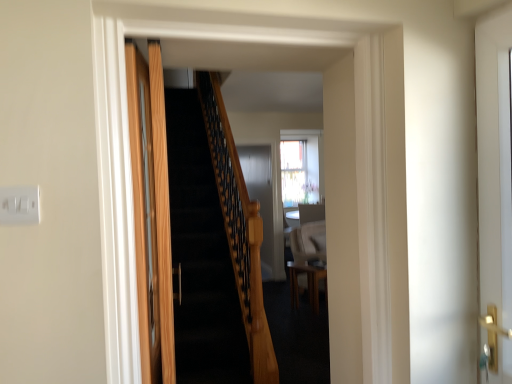
Question: Considering the relative sizes of wooden door at left, the 2th door positioned from the right, and white glossy door at right, the first door viewed from the right, in the image provided, is wooden door at left, the 2th door positioned from the right, wider than white glossy door at right, the first door viewed from the right,?

Choices:
 (A) yes
 (B) no

Answer: (A)

Question: Can you confirm if wooden door at left, the 2th door positioned from the right, is smaller than white glossy door at right, the first door viewed from the right?

Choices:
 (A) yes
 (B) no

Answer: (B)

Question: Does wooden door at left, which is the 1th door from left to right, appear on the left side of white glossy door at right, arranged as the 2th door when viewed from the left?

Choices:
 (A) yes
 (B) no

Answer: (A)

Question: From the image's perspective, does wooden door at left, which is the 1th door from left to right, appear higher than white glossy door at right, arranged as the 2th door when viewed from the left?

Choices:
 (A) yes
 (B) no

Answer: (B)

Question: From a real-world perspective, is wooden door at left, the 2th door positioned from the right, positioned over white glossy door at right, arranged as the 2th door when viewed from the left, based on gravity?

Choices:
 (A) yes
 (B) no

Answer: (B)

Question: Considering the positions of white plastic/light switch at upper left and wooden door at left, which is the 1th door from left to right, in the image, is white plastic/light switch at upper left bigger or smaller than wooden door at left, which is the 1th door from left to right,?

Choices:
 (A) big
 (B) small

Answer: (B)

Question: In terms of height, does white plastic/light switch at upper left look taller or shorter compared to wooden door at left, which is the 1th door from left to right?

Choices:
 (A) tall
 (B) short

Answer: (B)

Question: Does point (32, 221) appear closer or farther from the camera than point (141, 140)?

Choices:
 (A) farther
 (B) closer

Answer: (B)

Question: Do you think white plastic/light switch at upper left is within wooden door at left, the 2th door positioned from the right, or outside of it?

Choices:
 (A) inside
 (B) outside

Answer: (B)

Question: In the image, is wooden door at left, which is the 1th door from left to right, positioned in front of or behind white plastic/light switch at upper left?

Choices:
 (A) behind
 (B) front

Answer: (A)

Question: From their relative heights in the image, would you say wooden door at left, the 2th door positioned from the right, is taller or shorter than white plastic/light switch at upper left?

Choices:
 (A) short
 (B) tall

Answer: (B)

Question: Is point (145, 231) positioned closer to the camera than point (24, 198)?

Choices:
 (A) farther
 (B) closer

Answer: (A)

Question: Based on their positions, is wooden door at left, the 2th door positioned from the right, located to the left or right of white plastic/light switch at upper left?

Choices:
 (A) left
 (B) right

Answer: (B)

Question: From a real-world perspective, is white glossy door at right, the first door viewed from the right, positioned above or below wooden door at left, which is the 1th door from left to right?

Choices:
 (A) below
 (B) above

Answer: (B)

Question: Is white glossy door at right, the first door viewed from the right, wider or thinner than wooden door at left, which is the 1th door from left to right?

Choices:
 (A) thin
 (B) wide

Answer: (A)